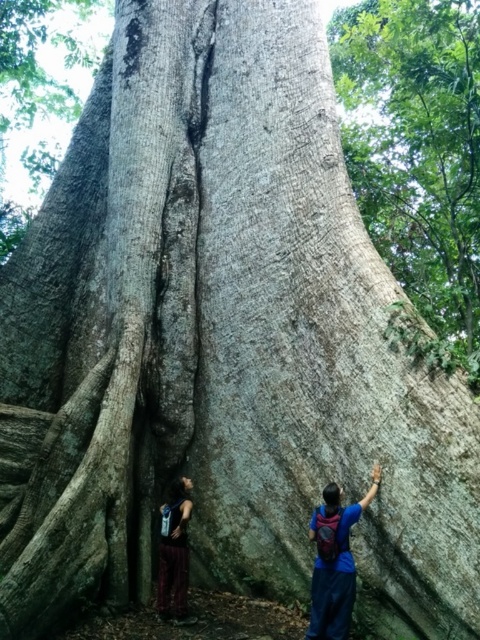
You are a hiker who wants to place your blue fabric backpack at right near the dark brown leather pants at lower left. Can you put the backpack there without moving the pants?

The blue fabric backpack at right is currently in front of the dark brown leather pants at lower left, so you can move the backpack to a position near the pants without needing to move them since they are already positioned lower left and the backpack can be placed adjacent to them.

You are a hiker who wants to place your blue fabric backpack at right and dark brown leather pants at lower left in a way that they are both visible from the front. Which object should you place first to ensure visibility?

The dark brown leather pants at lower left should be placed first because the blue fabric backpack at right is positioned on the right side of it, meaning the backpack is further to the right and would not block the pants if placed correctly.